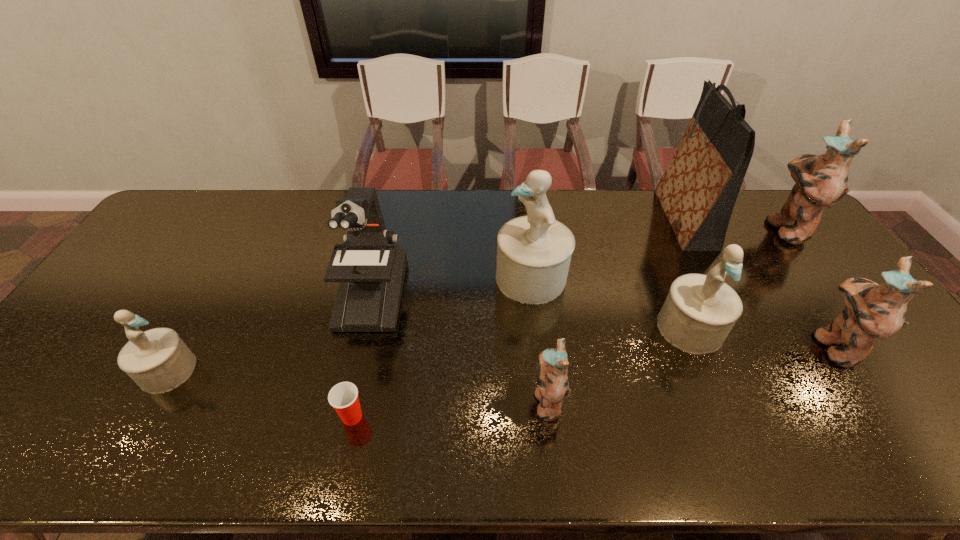
The width and height of the screenshot is (960, 540). I want to click on the tallest object, so click(698, 191).

Image resolution: width=960 pixels, height=540 pixels. What are the coordinates of `the biggest white figurine` in the screenshot? It's located at (534, 252).

At what (x,y) coordinates should I click in order to perform the action: click on the biggest pink figurine. Please return your answer as a coordinate pair (x, y). The width and height of the screenshot is (960, 540). Looking at the image, I should click on (821, 181).

Find the location of a particular element. the farthest figurine is located at coordinates (821, 181).

Where is `microscope`? Image resolution: width=960 pixels, height=540 pixels. microscope is located at coordinates [x=370, y=267].

In order to click on the third figurine from right to left in this screenshot , I will do `click(700, 310)`.

Find the location of a particular element. the second smallest white figurine is located at coordinates (700, 310).

Locate an element on the screen. the second nearest pink figurine is located at coordinates (872, 311).

Where is `the smallest white figurine`? This screenshot has height=540, width=960. the smallest white figurine is located at coordinates (157, 360).

The image size is (960, 540). What are the coordinates of `the leftmost object` in the screenshot? It's located at (157, 360).